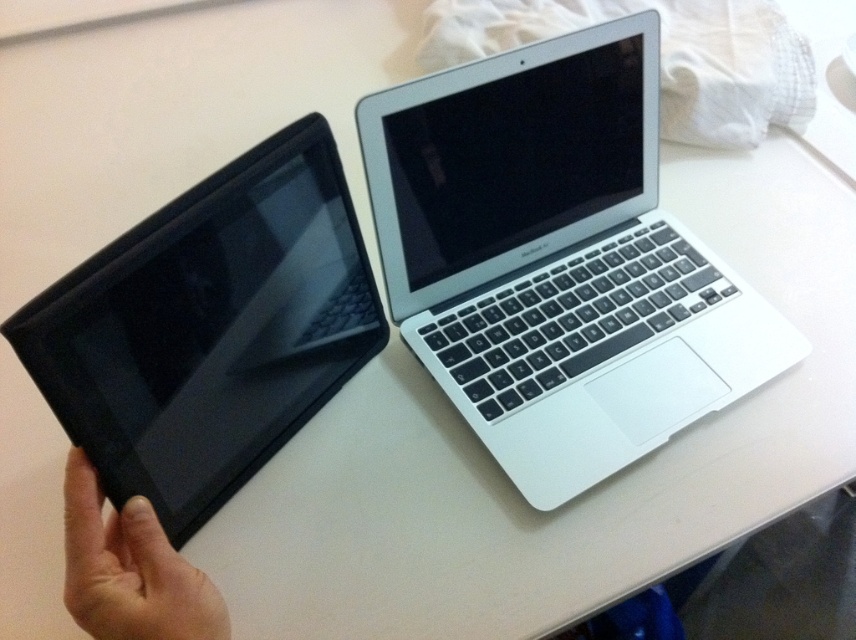
You are standing in front of a table with a silver metallic laptop at upper right. You want to pick up the tablet device on the left side without moving the laptop. Can you reach the tablet device on the left side while staying in your current position?

The silver metallic laptop at upper right is 25.77 inches away from the camera, so the distance between you and the tablet device on the left side is likely within reach. You can probably pick up the tablet device on the left side without moving the laptop.